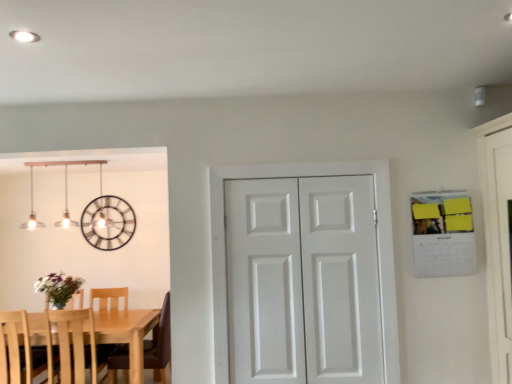
Question: Is metallic clock at upper left at the left side of matte silver pendant lights at upper left?

Choices:
 (A) no
 (B) yes

Answer: (A)

Question: Does metallic clock at upper left lie in front of matte silver pendant lights at upper left?

Choices:
 (A) yes
 (B) no

Answer: (B)

Question: Considering the relative sizes of metallic clock at upper left and matte silver pendant lights at upper left in the image provided, is metallic clock at upper left smaller than matte silver pendant lights at upper left?

Choices:
 (A) no
 (B) yes

Answer: (B)

Question: From a real-world perspective, is metallic clock at upper left positioned under matte silver pendant lights at upper left based on gravity?

Choices:
 (A) no
 (B) yes

Answer: (B)

Question: Could you tell me if metallic clock at upper left is facing matte silver pendant lights at upper left?

Choices:
 (A) yes
 (B) no

Answer: (A)

Question: From a real-world perspective, is metallic clock at upper left located higher than matte silver pendant lights at upper left?

Choices:
 (A) no
 (B) yes

Answer: (A)

Question: From the image's perspective, is metallic clock at upper left below light wood table at lower left?

Choices:
 (A) no
 (B) yes

Answer: (A)

Question: Considering the relative positions of metallic clock at upper left and light wood table at lower left in the image provided, is metallic clock at upper left behind light wood table at lower left?

Choices:
 (A) no
 (B) yes

Answer: (B)

Question: Could you tell me if metallic clock at upper left is turned towards light wood table at lower left?

Choices:
 (A) no
 (B) yes

Answer: (A)

Question: Is metallic clock at upper left not near light wood table at lower left?

Choices:
 (A) yes
 (B) no

Answer: (A)

Question: Is metallic clock at upper left not inside light wood table at lower left?

Choices:
 (A) no
 (B) yes

Answer: (B)

Question: Can you confirm if metallic clock at upper left is smaller than light wood table at lower left?

Choices:
 (A) no
 (B) yes

Answer: (B)

Question: From a real-world perspective, is light wood table at lower left located beneath light wood chair at left, which ranks as the 1th chair in right-to-left order?

Choices:
 (A) yes
 (B) no

Answer: (A)